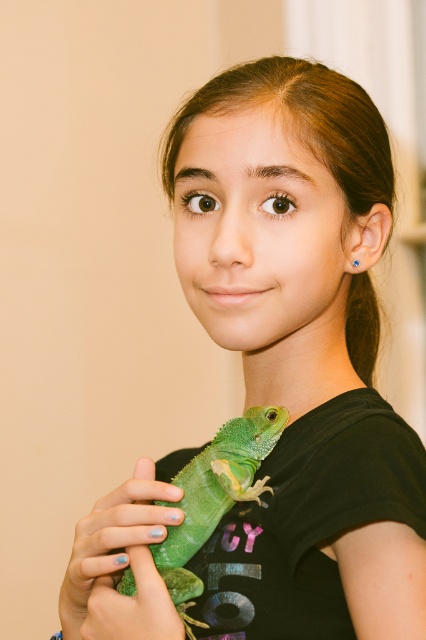
You are a photographer trying to capture the lizard on the girl. You notice two points in the image at coordinates point (101, 637) and point (210, 516). Which point should you focus on to ensure the lizard is in sharp focus?

Point (101, 637) is in front of point (210, 516), so focusing on point (101, 637) will ensure the lizard is in sharp focus.

In the scene shown: You are a photographer setting up a shoot. You have two green matte lizards in the scene. The green matte lizard at lower left and the green matte lizard at center. Which lizard is closer to the camera?

The green matte lizard at lower left is closer to the camera because it is in front of the green matte lizard at center.

You are a photographer trying to capture the lizard on the girl. You see the green matte lizard at lower left and the green matte lizard at center. Which lizard is closer to the camera?

The green matte lizard at center is closer to the camera because the green matte lizard at lower left is positioned under it, meaning it is further away from the viewer.